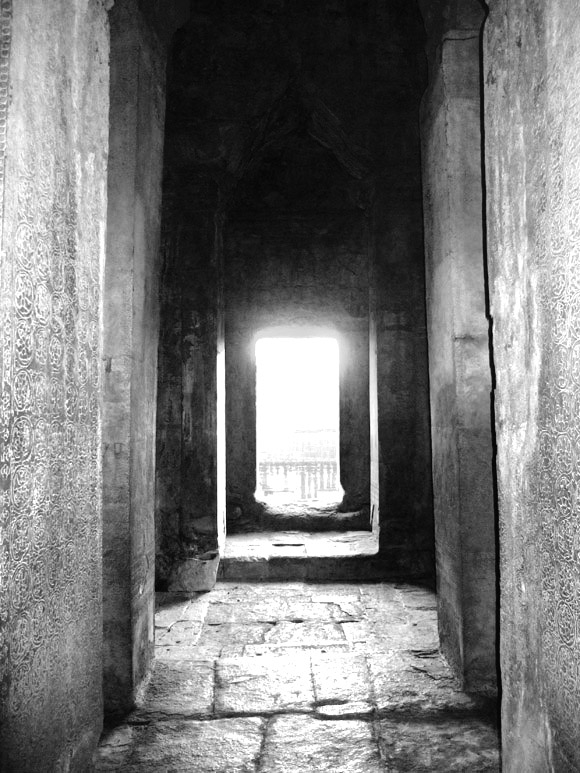
The height and width of the screenshot is (773, 580). I want to click on doorway, so click(x=293, y=438).